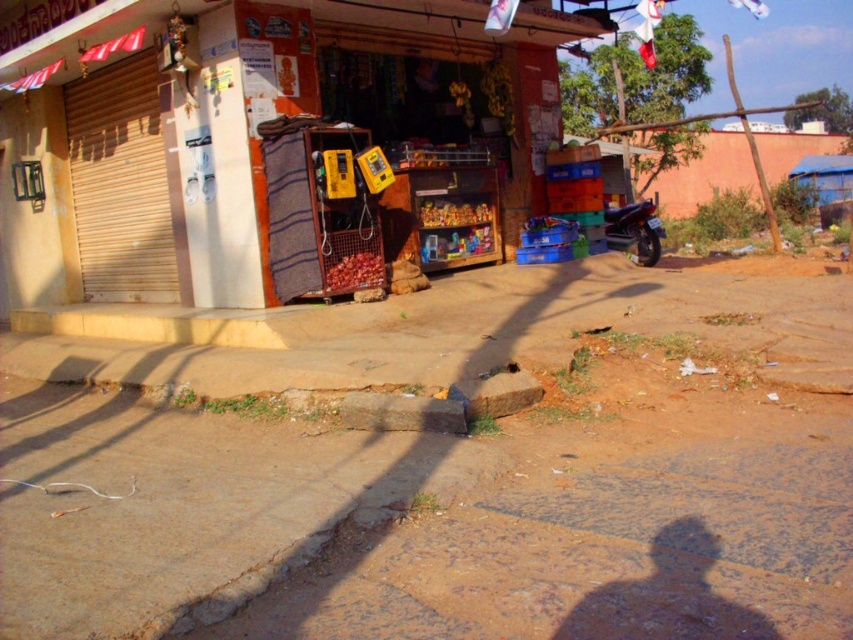
Question: Which of the following is the farthest from the observer?

Choices:
 (A) dull concrete pavement at center
 (B) yellow plastic phone box at center
 (C) metallic blue motorcycle at right

Answer: (C)

Question: Which object appears closest to the camera in this image?

Choices:
 (A) dull concrete pavement at center
 (B) metallic blue motorcycle at right
 (C) wooden crates at center
 (D) yellow plastic phone box at center

Answer: (C)

Question: Can you confirm if wooden crates at center is thinner than yellow plastic phone box at center?

Choices:
 (A) no
 (B) yes

Answer: (A)

Question: Which of the following is the farthest from the observer?

Choices:
 (A) (352, 115)
 (B) (613, 244)
 (C) (331, 195)
 (D) (467, 460)

Answer: (B)

Question: Observing the image, what is the correct spatial positioning of dull concrete pavement at center in reference to wooden crates at center?

Choices:
 (A) below
 (B) above

Answer: (A)

Question: From the image, what is the correct spatial relationship of dull concrete pavement at center in relation to metallic blue motorcycle at right?

Choices:
 (A) below
 (B) above

Answer: (A)